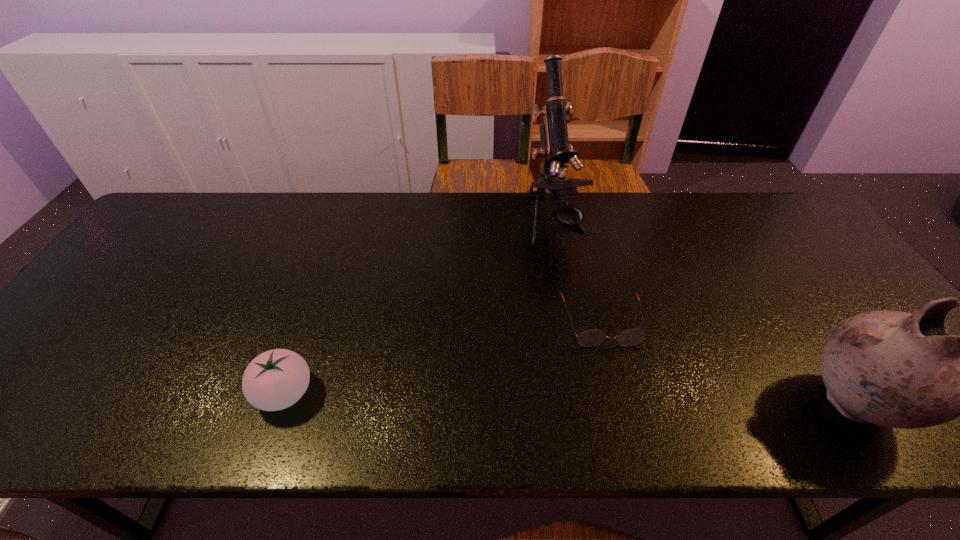
Identify the location of tomato. The image size is (960, 540). (276, 379).

Identify the location of the leftmost object. (276, 379).

Find the location of a particular element. The height and width of the screenshot is (540, 960). pottery is located at coordinates (894, 369).

Find the location of `the rightmost object`. the rightmost object is located at coordinates (894, 369).

Where is `the shortest object`? Image resolution: width=960 pixels, height=540 pixels. the shortest object is located at coordinates (592, 337).

Image resolution: width=960 pixels, height=540 pixels. Identify the location of spectacles. (592, 337).

Identify the location of the tallest object. (555, 151).

Where is `the farthest object`? the farthest object is located at coordinates point(555,151).

Find the location of a particular element. Image resolution: width=960 pixels, height=540 pixels. free region located on the right of the tomato is located at coordinates (443, 393).

The image size is (960, 540). What are the coordinates of `free location located 0.120m on the temples of the third nearest object` in the screenshot? It's located at (621, 395).